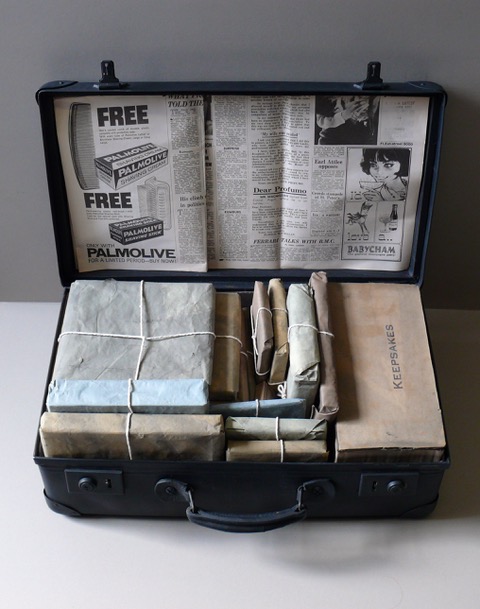
This screenshot has width=480, height=609. Find the location of `newspaper`. newspaper is located at coordinates (342, 198).